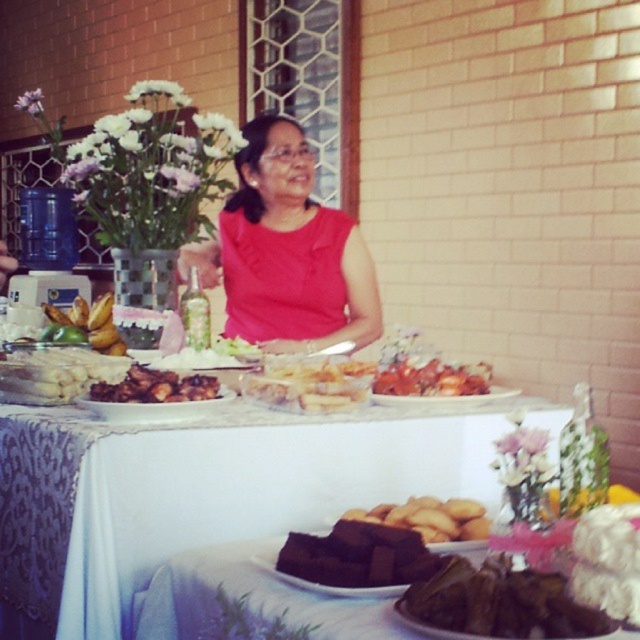
You are a guest at the table and want to grab a piece of the white glossy cake at left. Which direction should you move your hand to reach it from the green leafy food at lower center?

The white glossy cake at left is above the green leafy food at lower center, so you should move your hand upward to reach it.

You are standing at the edge of the table where the bouquet of flowers is placed. You want to pick up the matte red blouse at center. How many steps do you need to take to reach it if each step covers 2 feet?

The matte red blouse at center is 6.67 feet away from the viewer. Since each step covers 2 feet, dividing 6.67 by 2 gives approximately 3.33 steps. Therefore, you would need to take 4 steps to reach the matte red blouse at center.